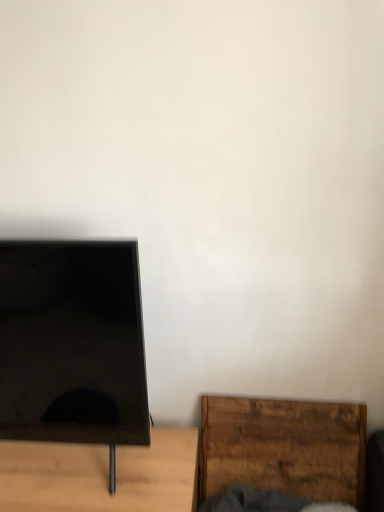
Locate an element on the screen. The height and width of the screenshot is (512, 384). empty space that is ontop of black matte tv stand at left, the first furniture viewed from the left (from a real-world perspective) is located at coordinates (81, 468).